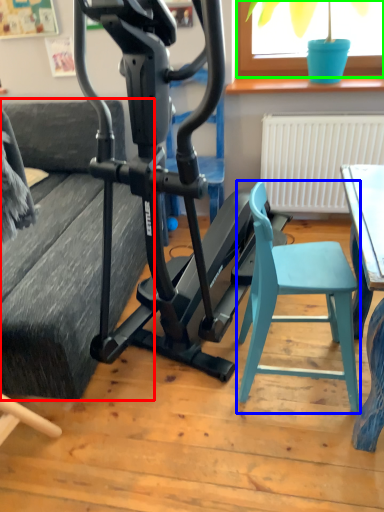
Question: Based on their relative distances, which object is nearer to couch (highlighted by a red box)? Choose from folding chair (highlighted by a blue box) and window screen (highlighted by a green box).

Choices:
 (A) folding chair
 (B) window screen

Answer: (A)